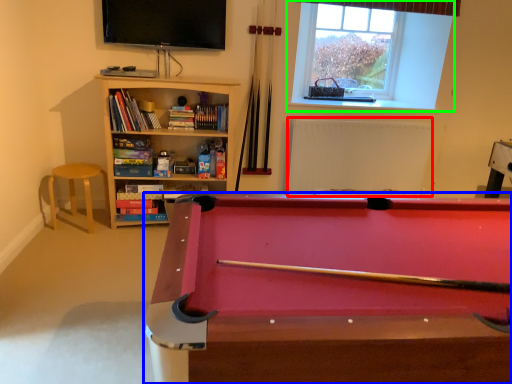
Question: Estimate the real-world distances between objects in this image. Which object is closer to radiator (highlighted by a red box), billiard table (highlighted by a blue box) or window (highlighted by a green box)?

Choices:
 (A) billiard table
 (B) window

Answer: (B)